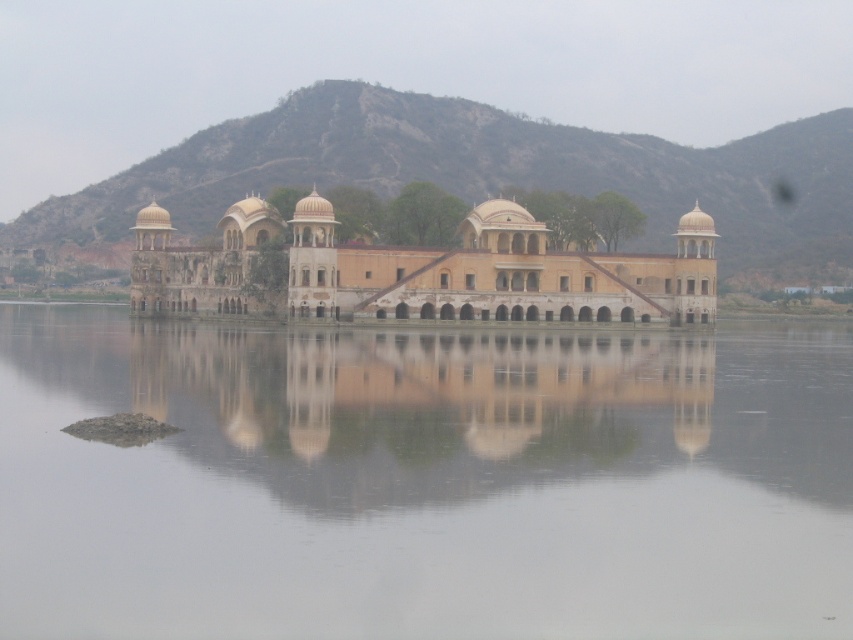
Question: Among these points, which one is nearest to the camera?

Choices:
 (A) tap(42, 620)
 (B) tap(682, 147)
 (C) tap(312, 464)
 (D) tap(498, 268)

Answer: (A)

Question: Can you confirm if transparent water at center is wider than beige stone palace at center?

Choices:
 (A) no
 (B) yes

Answer: (B)

Question: Based on their relative distances, which object is farther from the rustic stone mountain at upper center?

Choices:
 (A) beige stone palace at center
 (B) transparent water at center

Answer: (B)

Question: Does transparent water at center appear on the left side of beige stone palace at center?

Choices:
 (A) no
 (B) yes

Answer: (A)

Question: Among these objects, which one is nearest to the camera?

Choices:
 (A) smooth sandstone palace at center
 (B) beige stone palace at center
 (C) transparent water at center

Answer: (C)

Question: Can you confirm if transparent water at center is positioned to the left of smooth sandstone palace at center?

Choices:
 (A) yes
 (B) no

Answer: (B)